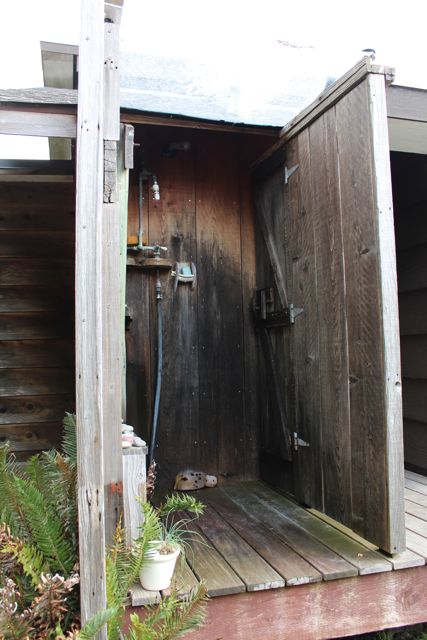
Locate an element on the screen. Image resolution: width=427 pixels, height=640 pixels. hinge is located at coordinates (297, 445).